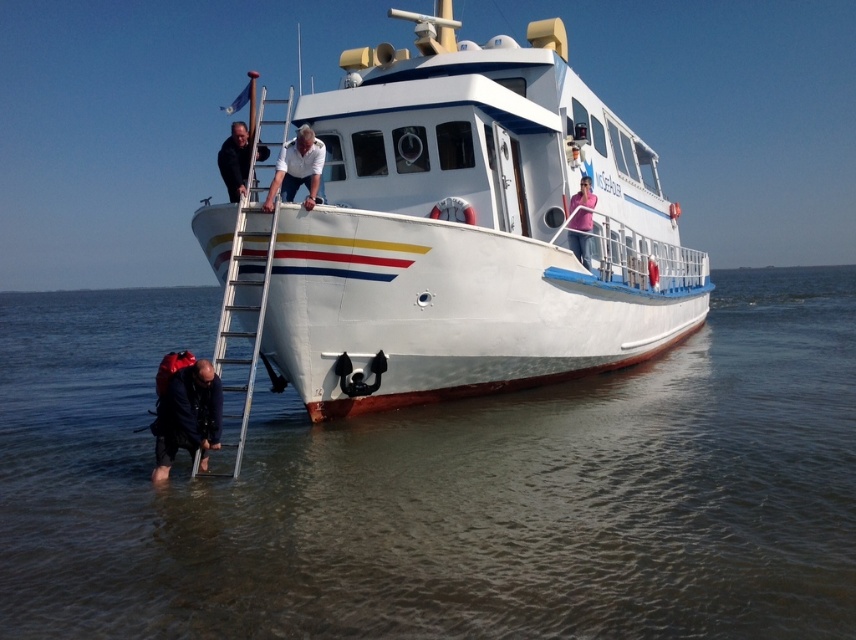
Does clear water at lower left have a greater width compared to dark blue backpack at lower left?

Correct, the width of clear water at lower left exceeds that of dark blue backpack at lower left.

Is clear water at lower left above dark blue backpack at lower left?

Correct, clear water at lower left is located above dark blue backpack at lower left.

Is point (837, 272) positioned before point (185, 392)?

No, (837, 272) is behind (185, 392).

You are a GUI agent. You are given a task and a screenshot of the screen. Output one action in this format:
    pyautogui.click(x=<x>, y=<y>)
    Task: Click on the clear water at lower left
    The image size is (856, 640).
    Given the screenshot: What is the action you would take?
    pyautogui.click(x=440, y=488)

Looking at this image, who is lower down, white glossy boat at center or pink fabric shirt at upper center?

pink fabric shirt at upper center is below.

Can you confirm if white glossy boat at center is bigger than pink fabric shirt at upper center?

Correct, white glossy boat at center is larger in size than pink fabric shirt at upper center.

Which is behind, point (548, 192) or point (590, 186)?

Point (590, 186)

Where is `white glossy boat at center`? The width and height of the screenshot is (856, 640). white glossy boat at center is located at coordinates (470, 230).

Is point (366, 205) positioned after point (207, 406)?

Yes, it is behind point (207, 406).

Does white glossy boat at center lie behind dark blue backpack at lower left?

That is True.

Which is in front, point (516, 240) or point (169, 385)?

Point (169, 385) is more forward.

The image size is (856, 640). Identify the location of white glossy boat at center. (470, 230).